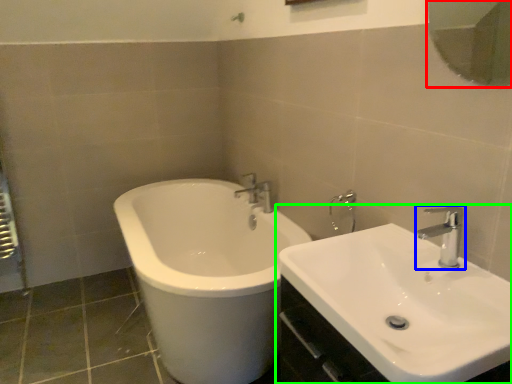
Question: Considering the real-world distances, which object is closest to mirror (highlighted by a red box)? tap (highlighted by a blue box) or sink (highlighted by a green box).

Choices:
 (A) tap
 (B) sink

Answer: (A)